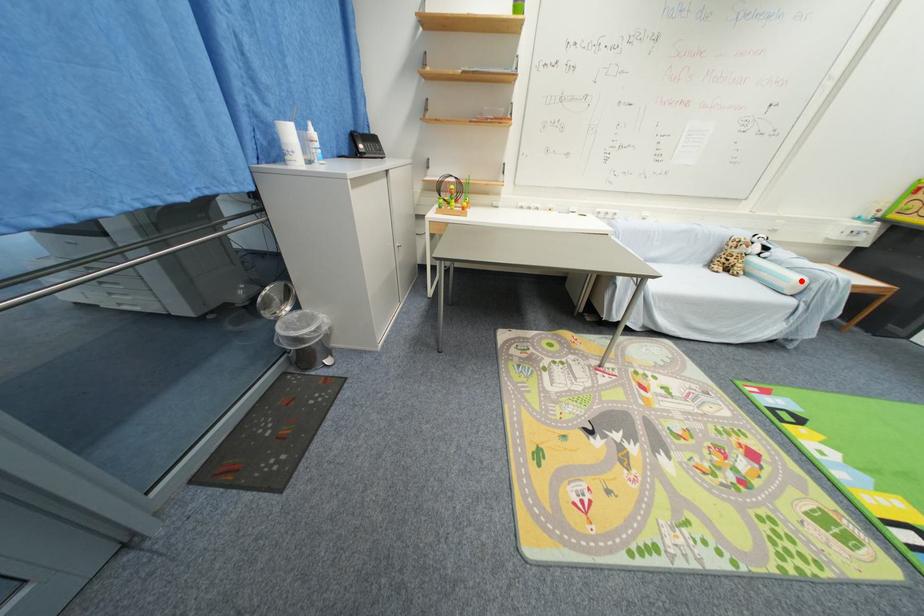
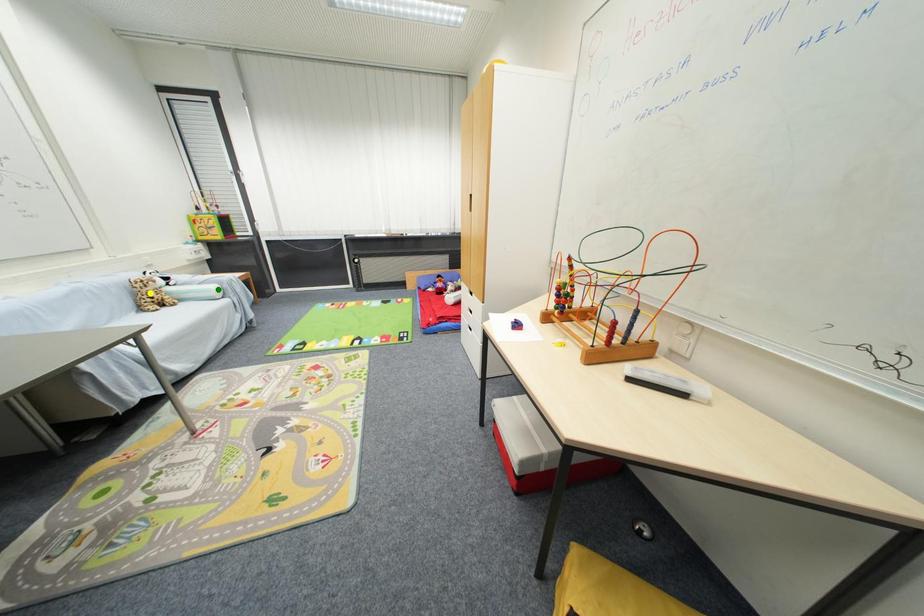
Question: I am providing you with two images of the same scene from different viewpoints. A red point is marked on the first image. You are given multiple points on the second image. Which point in image 2 represents the same 3d spot as the red point in image 1?

Choices:
 (A) blue point
 (B) yellow point
 (C) green point

Answer: (C)